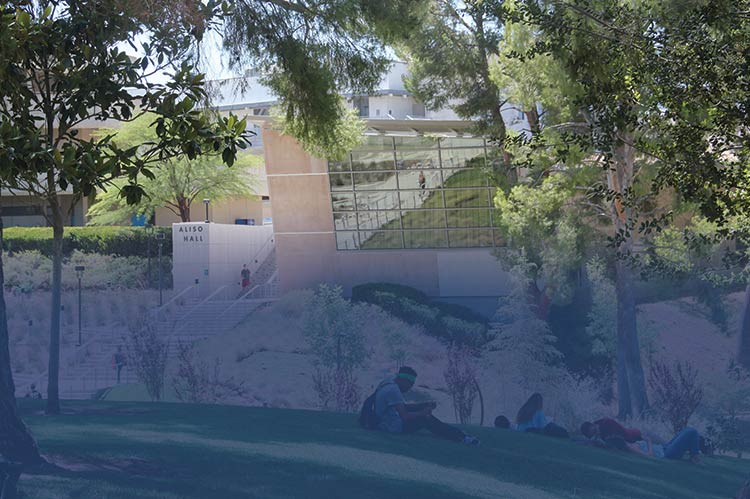
At what (x,y) coordinates should I click in order to perform the action: click on reflection of the stairwell in the window. Please return your answer as a coordinate pair (x, y). Image resolution: width=750 pixels, height=499 pixels. Looking at the image, I should click on (398, 185).